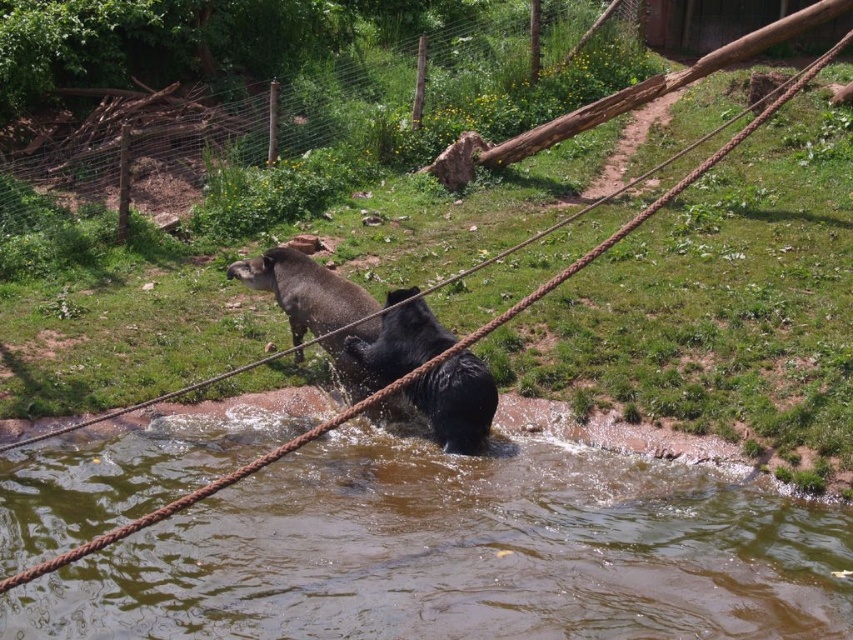
Does brown muddy water at lower center appear on the right side of shiny black bear at center?

Correct, you'll find brown muddy water at lower center to the right of shiny black bear at center.

Is the position of brown muddy water at lower center more distant than that of shiny black bear at center?

That is False.

The image size is (853, 640). What are the coordinates of `brown muddy water at lower center` in the screenshot? It's located at (460, 554).